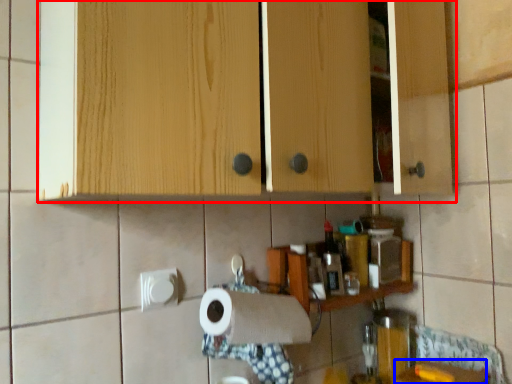
Question: Which of the following is the closest to the observer, cabinetry (highlighted by a red box) or counter top (highlighted by a blue box)?

Choices:
 (A) cabinetry
 (B) counter top

Answer: (A)